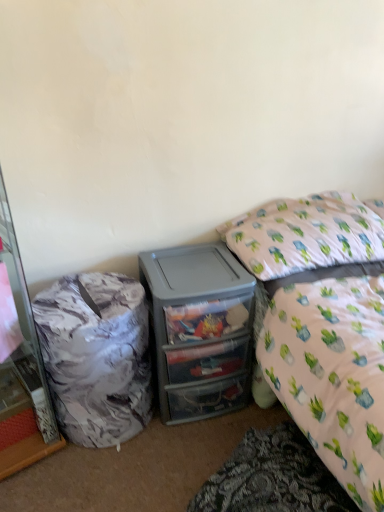
At what (x,y) coordinates should I click in order to perform the action: click on vacant space that is in between translucent plastic drawers at center and marble-patterned trash can at left. Please return your answer as a coordinate pair (x, y). The width and height of the screenshot is (384, 512). Looking at the image, I should click on (143, 444).